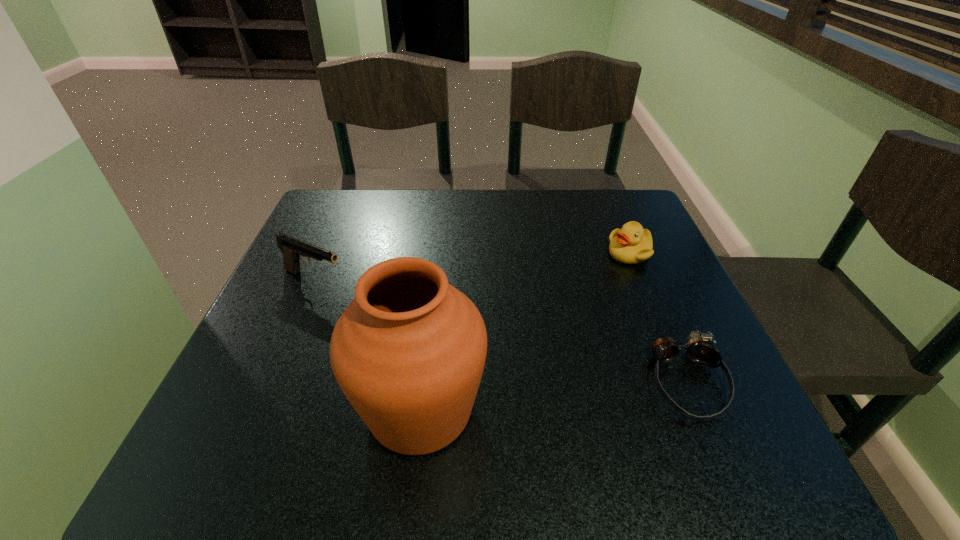
Identify the location of vacant position located 0.170m at the muzzle of the leftmost object. (407, 312).

You are a GUI agent. You are given a task and a screenshot of the screen. Output one action in this format:
    pyautogui.click(x=<x>, y=<y>)
    Task: Click on the blank space located at the muzzle of the leftmost object
    
    Given the screenshot: What is the action you would take?
    pyautogui.click(x=403, y=310)

You are a GUI agent. You are given a task and a screenshot of the screen. Output one action in this format:
    pyautogui.click(x=<x>, y=<y>)
    Task: Click on the free space located at the muzzle of the leftmost object
    
    Given the screenshot: What is the action you would take?
    pyautogui.click(x=432, y=322)

Identify the location of object located at the far edge. (631, 244).

Identify the location of urn that is positioned at the near edge. (409, 351).

The image size is (960, 540). I want to click on goggles that is at the near edge, so click(700, 350).

This screenshot has width=960, height=540. In order to click on object situated at the left edge in this screenshot , I will do `click(293, 249)`.

The image size is (960, 540). Identify the location of goggles located in the right edge section of the desktop. (700, 350).

Find the location of `duckling at the right edge`. duckling at the right edge is located at coordinates (631, 244).

Identify the location of object located in the far right corner section of the desktop. The width and height of the screenshot is (960, 540). (631, 244).